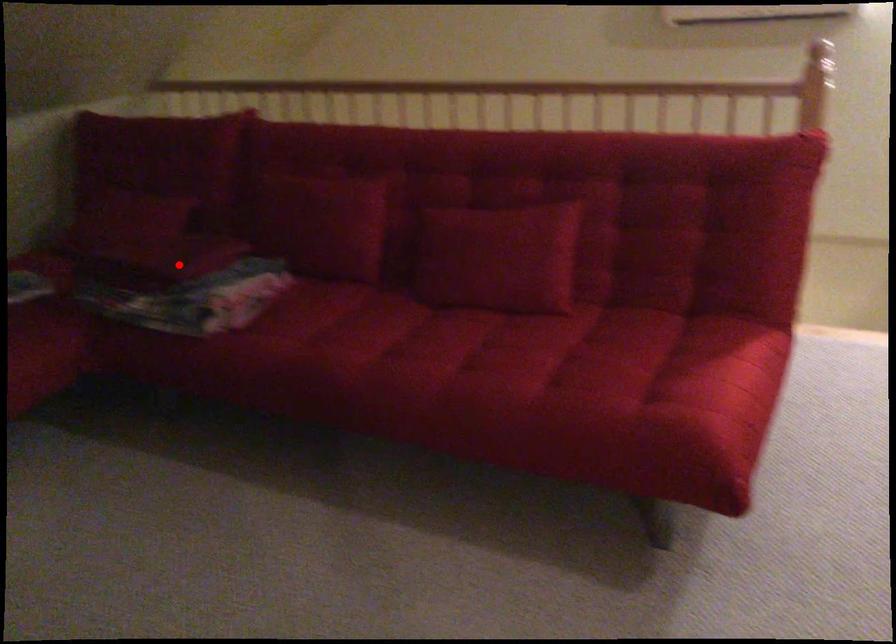
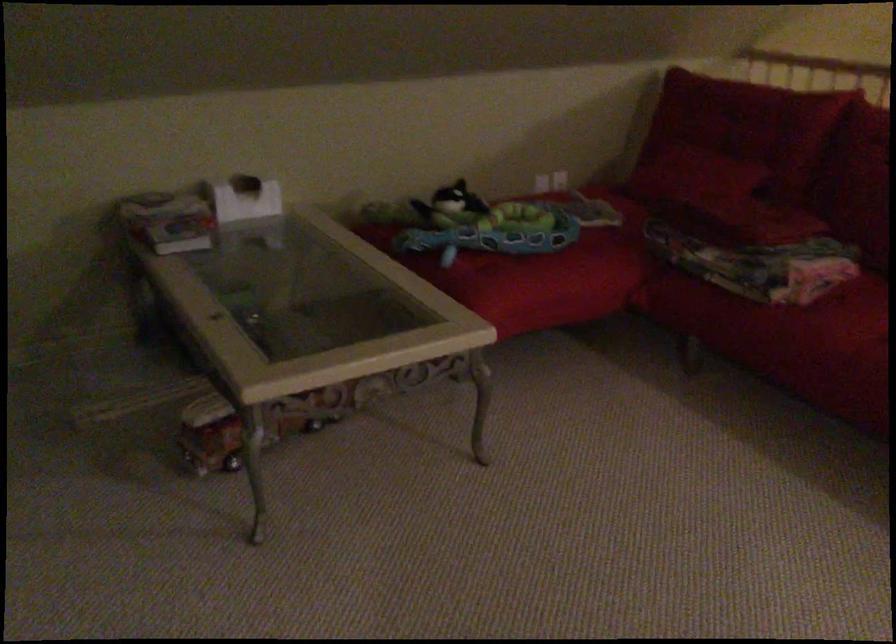
Find the pixel in the second image that matches the highlighted location in the first image.

(761, 220)